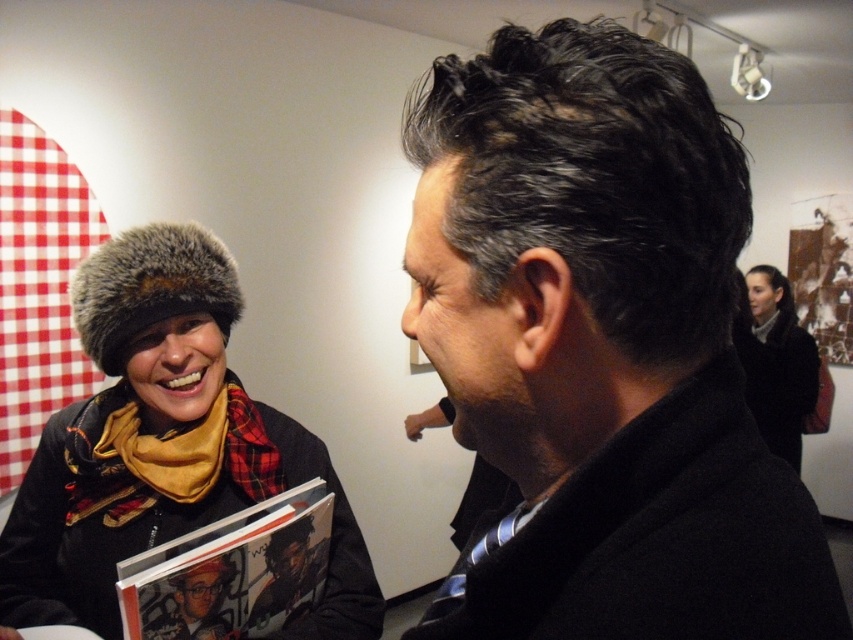
You are a photographer trying to capture a clear shot of the matte black book at center without the black wool coat at upper right blocking it. Based on their positions, can you adjust your angle to do so?

The black wool coat at upper right is in front of the matte black book at center, so adjusting your angle to move around the coat would allow you to capture the book without obstruction.

You are an interior designer planning to place a new coat rack in the gallery. The coat rack must be positioned between the black wool coat at upper right and the matte black book at center. Considering their sizes, which object requires more space for the rack to accommodate both?

The black wool coat at upper right requires more space because its width is larger than the matte black book at center.